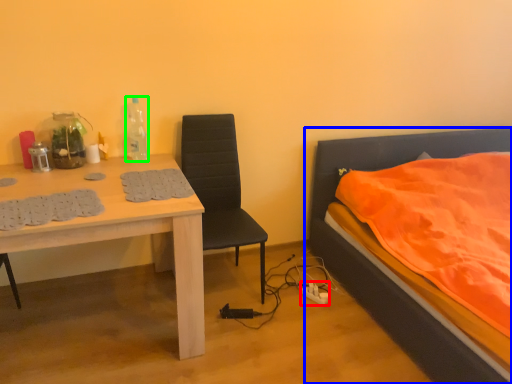
Question: Based on their relative distances, which object is farther from power outlet (highlighted by a red box)? Choose from bed (highlighted by a blue box) and bottle (highlighted by a green box).

Choices:
 (A) bed
 (B) bottle

Answer: (B)